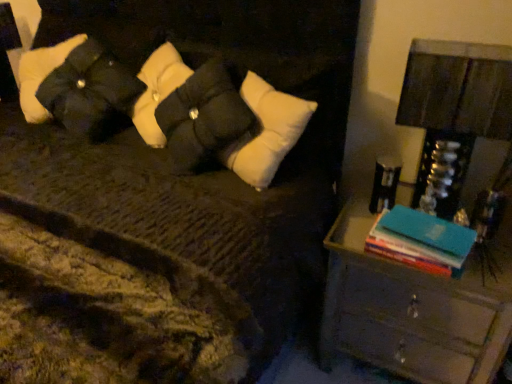
Question: Does wooden nightstand at right come behind metallic silver lampshade at right?

Choices:
 (A) yes
 (B) no

Answer: (A)

Question: Is wooden nightstand at right with metallic silver lampshade at right?

Choices:
 (A) yes
 (B) no

Answer: (B)

Question: Is wooden nightstand at right smaller than metallic silver lampshade at right?

Choices:
 (A) yes
 (B) no

Answer: (B)

Question: From a real-world perspective, is wooden nightstand at right over metallic silver lampshade at right?

Choices:
 (A) no
 (B) yes

Answer: (A)

Question: Does wooden nightstand at right have a greater width compared to metallic silver lampshade at right?

Choices:
 (A) yes
 (B) no

Answer: (A)

Question: Does wooden nightstand at right appear on the left side of metallic silver lampshade at right?

Choices:
 (A) no
 (B) yes

Answer: (B)

Question: Considering the relative sizes of metallic silver lampshade at right and black quilted pillow at upper left in the image provided, is metallic silver lampshade at right bigger than black quilted pillow at upper left?

Choices:
 (A) yes
 (B) no

Answer: (B)

Question: Considering the relative sizes of metallic silver lampshade at right and black quilted pillow at upper left in the image provided, is metallic silver lampshade at right taller than black quilted pillow at upper left?

Choices:
 (A) yes
 (B) no

Answer: (A)

Question: Is metallic silver lampshade at right positioned before black quilted pillow at upper left?

Choices:
 (A) no
 (B) yes

Answer: (B)

Question: Is metallic silver lampshade at right thinner than black quilted pillow at upper left?

Choices:
 (A) yes
 (B) no

Answer: (A)

Question: Does metallic silver lampshade at right have a smaller size compared to black quilted pillow at upper left?

Choices:
 (A) yes
 (B) no

Answer: (A)

Question: Is metallic silver lampshade at right oriented away from black quilted pillow at upper left?

Choices:
 (A) yes
 (B) no

Answer: (B)

Question: Considering the relative positions of metallic silver lampshade at right and wooden nightstand at right in the image provided, is metallic silver lampshade at right behind wooden nightstand at right?

Choices:
 (A) no
 (B) yes

Answer: (A)